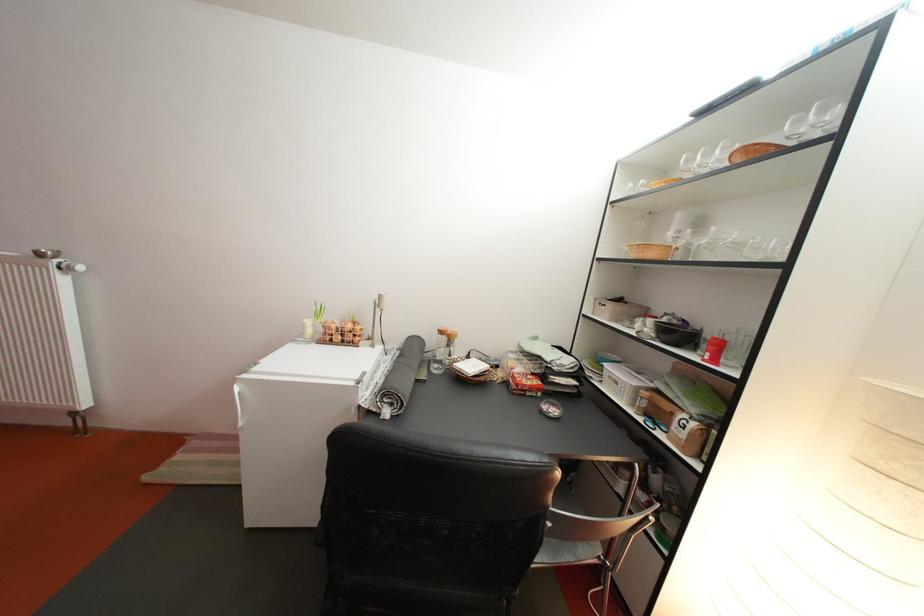
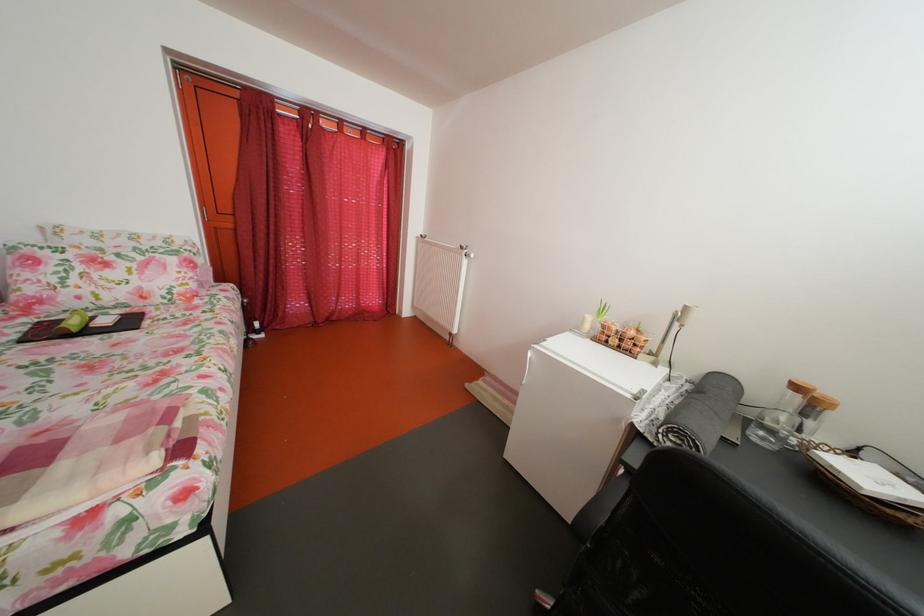
Find the pixel in the second image that matches [52,261] in the first image.

(473, 254)